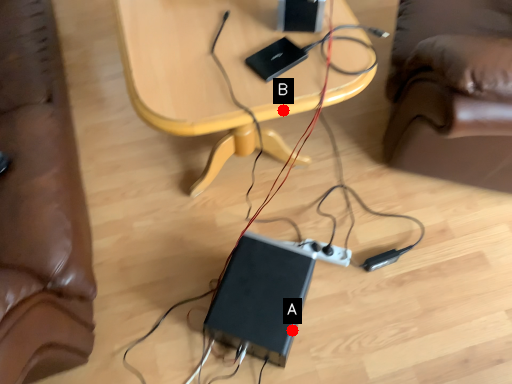
Question: Two points are circled on the image, labeled by A and B beside each circle. Which point appears farthest from the camera in this image?

Choices:
 (A) A is further
 (B) B is further

Answer: (A)